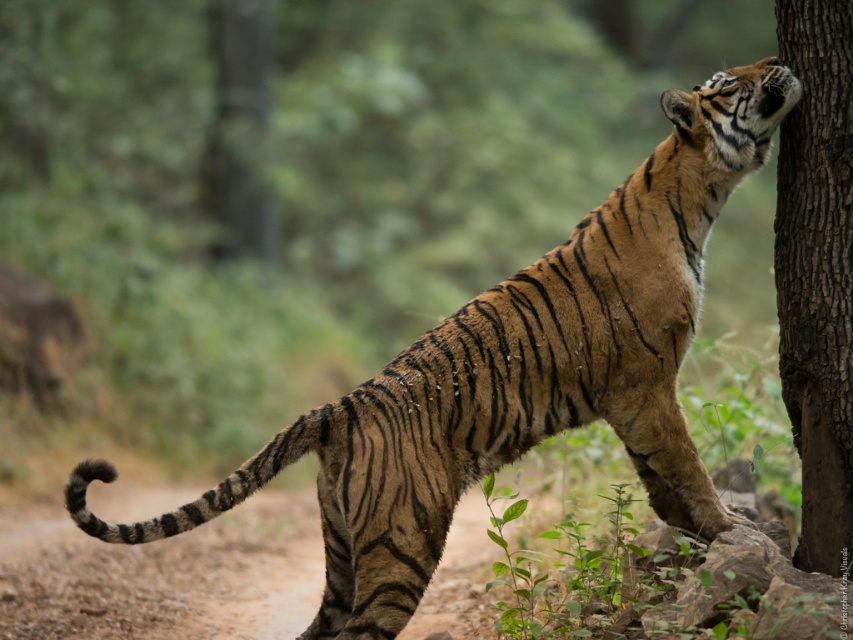
Question: Can you confirm if brown dirt track at lower center is bigger than brown rough tree trunk at right?

Choices:
 (A) no
 (B) yes

Answer: (A)

Question: Can you confirm if brown dirt track at lower center is positioned to the right of brown rough tree trunk at right?

Choices:
 (A) no
 (B) yes

Answer: (A)

Question: Which object appears farthest from the camera in this image?

Choices:
 (A) brown rough tree trunk at right
 (B) brown dirt track at lower center

Answer: (B)

Question: Can you confirm if brown dirt track at lower center is bigger than brown rough tree trunk at right?

Choices:
 (A) no
 (B) yes

Answer: (A)

Question: Among these objects, which one is nearest to the camera?

Choices:
 (A) brown dirt track at lower center
 (B) brown rough tree trunk at right

Answer: (B)